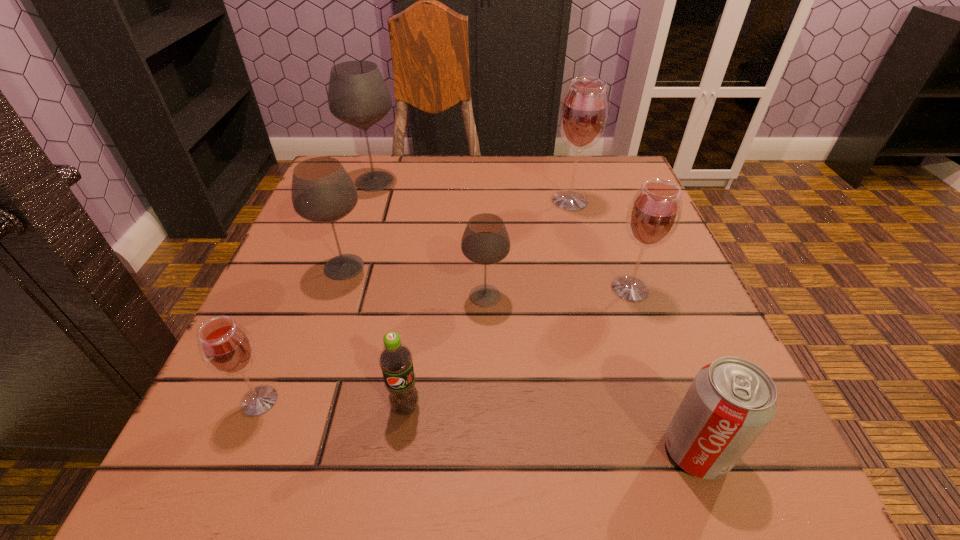
At what (x,y) coordinates should I click in order to perform the action: click on vacant space in between the second smallest gray wineglass and the nearest red wineglass. Please return your answer as a coordinate pair (x, y). Looking at the image, I should click on (301, 334).

This screenshot has height=540, width=960. I want to click on vacant space that is in between the nearest wineglass and the second smallest gray wineglass, so click(x=301, y=334).

Locate which object is the fourth closest to the nearer soda can. Please provide its 2D coordinates. Your answer should be formatted as a tuple, i.e. [(x, y)], where the tuple contains the x and y coordinates of a point satisfying the conditions above.

[(584, 111)]

What are the coordinates of `object that is the seventh nearest to the second smallest gray wineglass` in the screenshot? It's located at (730, 402).

At what (x,y) coordinates should I click in order to perform the action: click on wineglass that stands as the third closest to the farthest red wineglass. Please return your answer as a coordinate pair (x, y). The height and width of the screenshot is (540, 960). Looking at the image, I should click on (358, 95).

Image resolution: width=960 pixels, height=540 pixels. I want to click on wineglass that stands as the third closest to the biggest gray wineglass, so click(584, 111).

Where is `gray wineglass that can be found as the closest to the farthest red wineglass`? gray wineglass that can be found as the closest to the farthest red wineglass is located at coordinates (485, 241).

Where is `gray wineglass that is the second closest to the farthest gray wineglass`? The width and height of the screenshot is (960, 540). gray wineglass that is the second closest to the farthest gray wineglass is located at coordinates (485, 241).

Select which red wineglass appears as the closest to the farthest red wineglass. Please provide its 2D coordinates. Your answer should be formatted as a tuple, i.e. [(x, y)], where the tuple contains the x and y coordinates of a point satisfying the conditions above.

[(653, 215)]

Where is `red wineglass that is the third nearest to the green soda`? This screenshot has height=540, width=960. red wineglass that is the third nearest to the green soda is located at coordinates (584, 111).